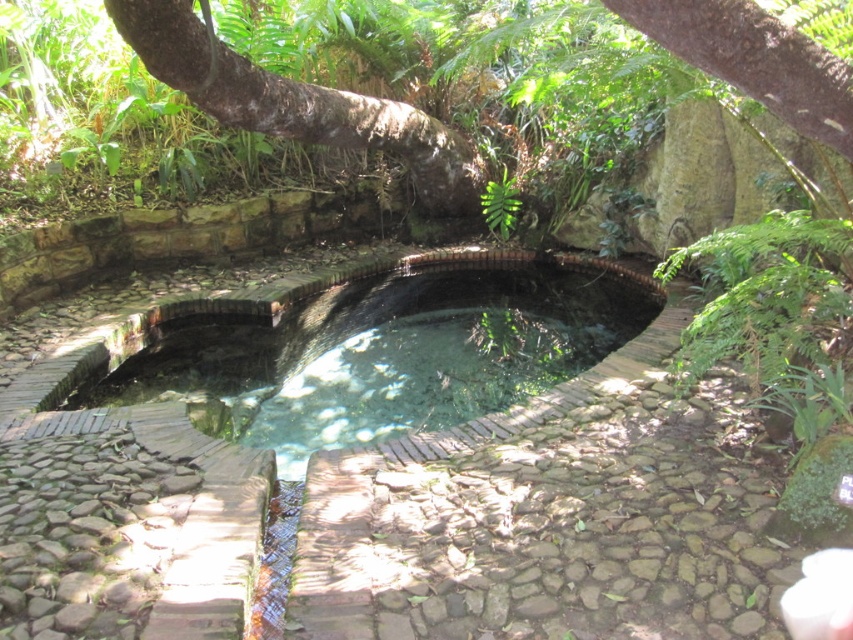
Question: Which point is farther from the camera taking this photo?

Choices:
 (A) (468, 404)
 (B) (456, 198)

Answer: (B)

Question: Which of the following is the closest to the observer?

Choices:
 (A) (566, 300)
 (B) (514, 188)
 (C) (144, 17)

Answer: (C)

Question: Is clear glass pool at center to the left of brown rough bark tree at upper center from the viewer's perspective?

Choices:
 (A) yes
 (B) no

Answer: (B)

Question: Which point is farther to the camera?

Choices:
 (A) green leafy fern at center
 (B) brown rough bark tree at upper center
 (C) clear glass pool at center

Answer: (A)

Question: Is the position of brown rough bark tree at upper center less distant than that of green leafy fern at center?

Choices:
 (A) no
 (B) yes

Answer: (B)

Question: Does brown rough bark tree at upper center appear over green leafy fern at center?

Choices:
 (A) yes
 (B) no

Answer: (A)